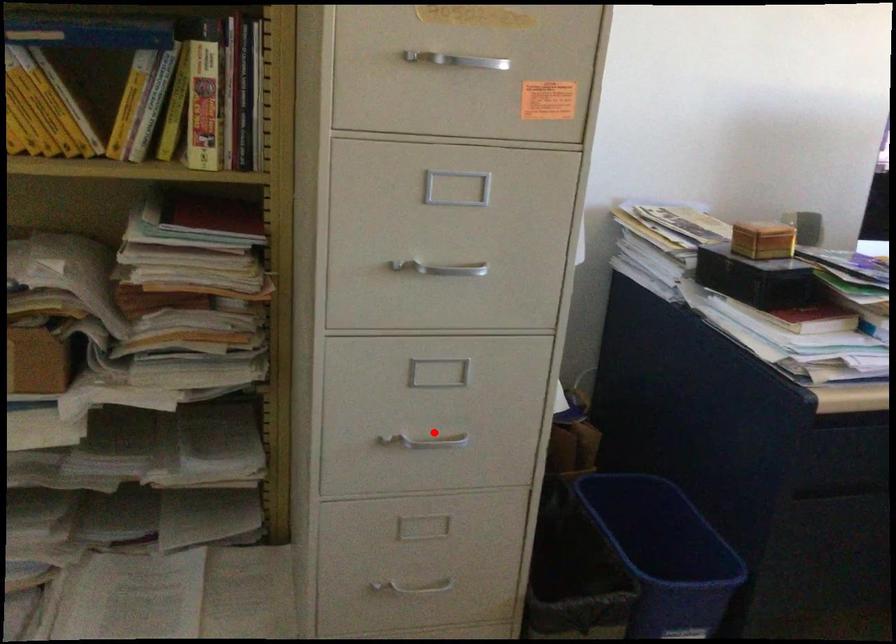
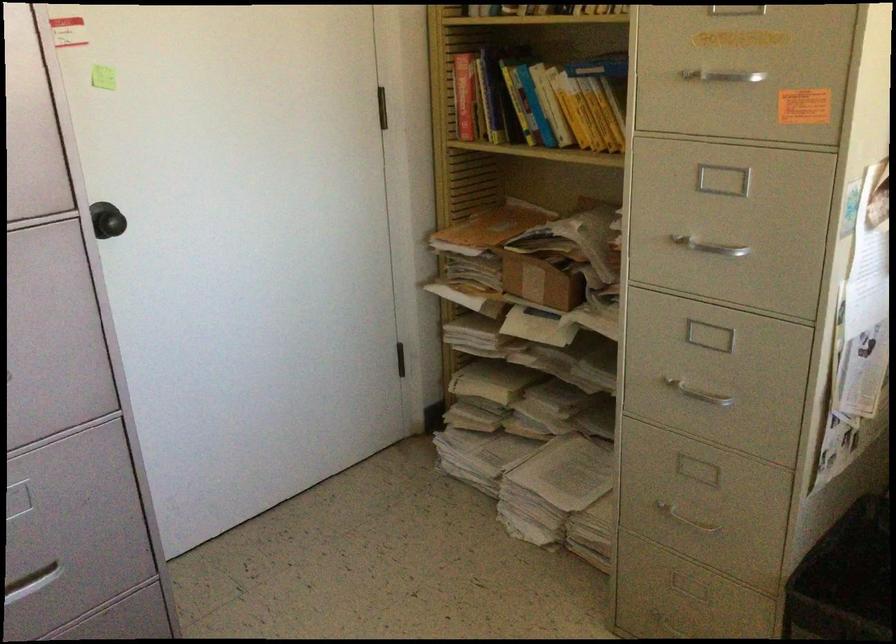
Question: A red point is marked in image1. In image2, is the corresponding 3D point closer to the camera or farther? Reply with the corresponding letter.

Choices:
 (A) The corresponding 3D point is closer.
 (B) The corresponding 3D point is farther.

Answer: (B)